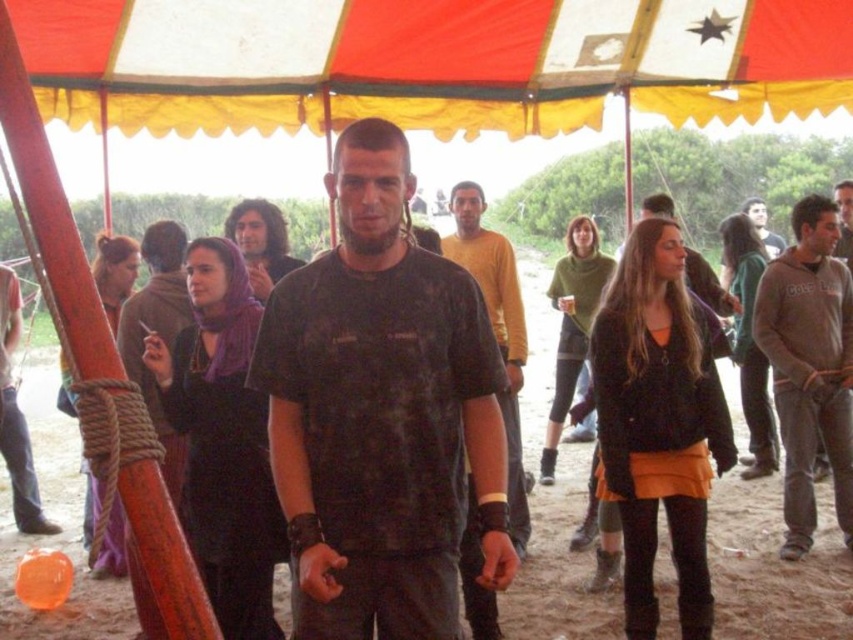
Based on the coordinates provided, which object is located at point (428, 61) in the scene?

The point (428, 61) marks the red and white striped canopy at upper center.